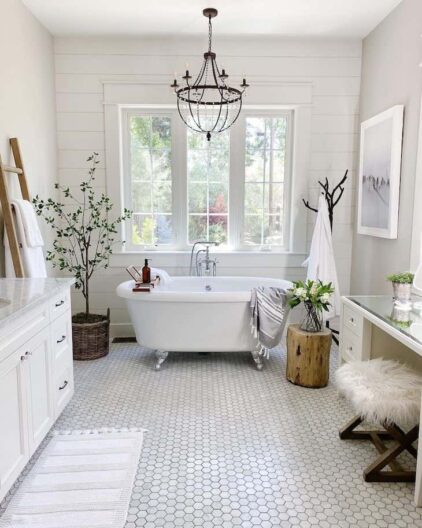
The height and width of the screenshot is (528, 422). Find the location of `white hexagon tile floor`. white hexagon tile floor is located at coordinates (235, 447).